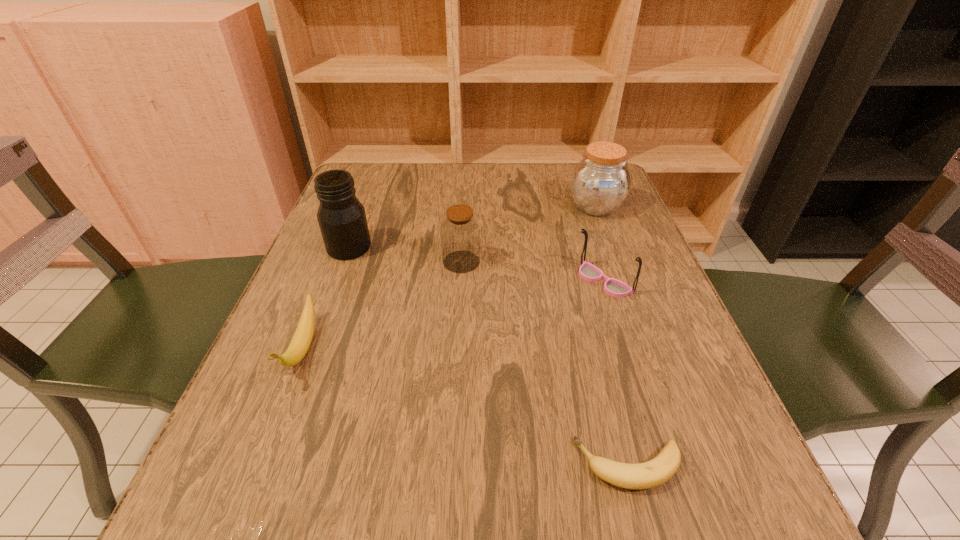
Identify the location of jar present at the left edge. The image size is (960, 540). (342, 220).

This screenshot has width=960, height=540. In order to click on banana at the left edge in this screenshot , I will do `click(300, 343)`.

What are the coordinates of `jar that is at the right edge` in the screenshot? It's located at (601, 181).

You are a GUI agent. You are given a task and a screenshot of the screen. Output one action in this format:
    pyautogui.click(x=<x>, y=<y>)
    Task: Click on the spectacles at the right edge
    This screenshot has width=960, height=540.
    Given the screenshot: What is the action you would take?
    pyautogui.click(x=616, y=288)

Identify the location of banana that is at the right edge. The height and width of the screenshot is (540, 960). (657, 471).

Locate an element on the screen. This screenshot has width=960, height=540. object at the far right corner is located at coordinates (601, 181).

Find the location of `object positioned at the near right corner`. object positioned at the near right corner is located at coordinates (657, 471).

You are a GUI agent. You are given a task and a screenshot of the screen. Output one action in this format:
    pyautogui.click(x=<x>, y=<y>)
    Task: Click on the vacant space at the far edge of the desktop
    
    Given the screenshot: What is the action you would take?
    pyautogui.click(x=439, y=205)

Where is `vacant space at the near edge of the desktop`? vacant space at the near edge of the desktop is located at coordinates (454, 522).

This screenshot has width=960, height=540. Identify the location of vacant space at the left edge of the desktop. (x=315, y=338).